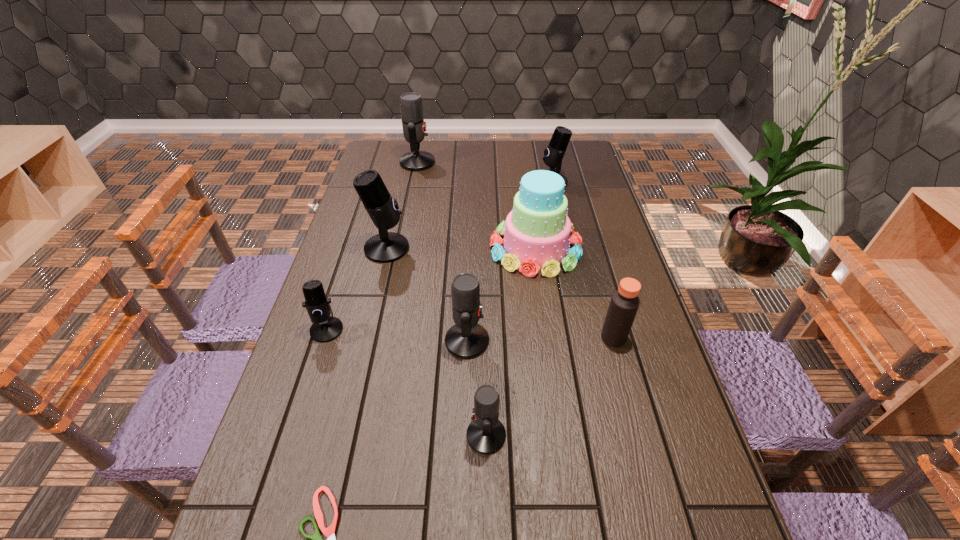
Identify the location of the farthest microphone. This screenshot has height=540, width=960. (414, 128).

The image size is (960, 540). I want to click on the farthest red microphone, so click(414, 128).

Locate an element on the screen. The image size is (960, 540). the biggest black microphone is located at coordinates (385, 247).

Find the location of a particular element. Image resolution: width=960 pixels, height=540 pixels. the third farthest microphone is located at coordinates (385, 247).

Locate an element on the screen. The image size is (960, 540). blue cake is located at coordinates (537, 231).

The height and width of the screenshot is (540, 960). In order to click on the rightmost microphone in this screenshot , I will do `click(553, 155)`.

Where is `the second smallest black microphone`? the second smallest black microphone is located at coordinates (553, 155).

I want to click on the second biggest red microphone, so click(x=467, y=339).

Find the location of a particular element. brown vinegar is located at coordinates (624, 303).

This screenshot has height=540, width=960. What are the coordinates of `the smallest black microphone` in the screenshot? It's located at (325, 328).